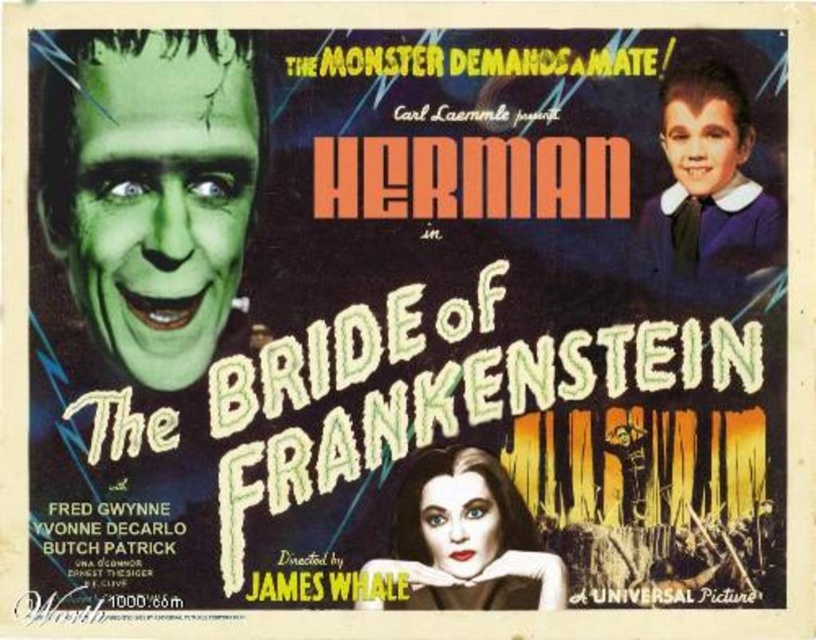
Question: Is green matte face at left positioned in front of purple matte shirt at upper right?

Choices:
 (A) yes
 (B) no

Answer: (A)

Question: Considering the real-world distances, which object is farthest from the green matte face at left?

Choices:
 (A) smooth black hair at center
 (B) purple matte shirt at upper right

Answer: (B)

Question: Which point appears farthest from the camera in this image?

Choices:
 (A) (55, 88)
 (B) (428, 509)
 (C) (765, 225)

Answer: (C)

Question: Is green matte face at left bigger than purple matte shirt at upper right?

Choices:
 (A) yes
 (B) no

Answer: (A)

Question: Does green matte face at left appear under purple matte shirt at upper right?

Choices:
 (A) yes
 (B) no

Answer: (A)

Question: Which of the following is the farthest from the observer?

Choices:
 (A) smooth black hair at center
 (B) green matte face at left

Answer: (A)